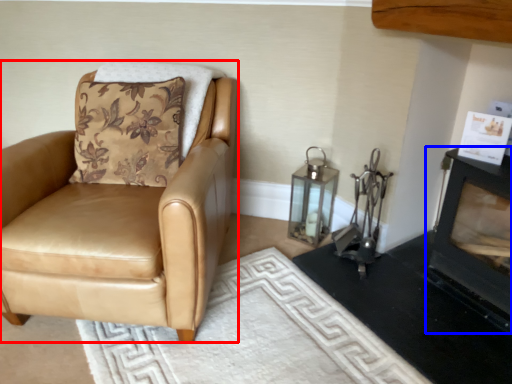
Question: Which of the following is the farthest to the observer, chair (highlighted by a red box) or fireplace (highlighted by a blue box)?

Choices:
 (A) chair
 (B) fireplace

Answer: (A)